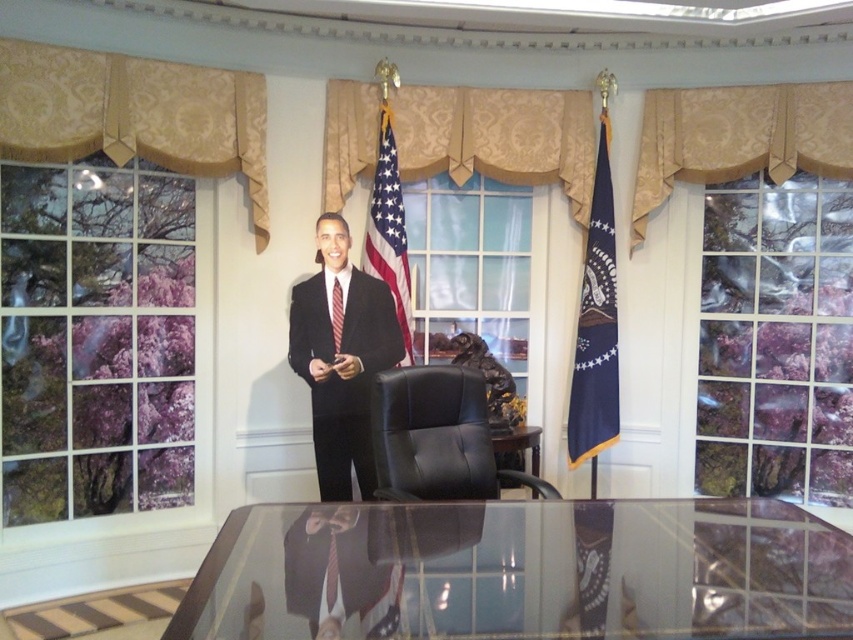
Which is behind, point (320, 344) or point (334, 317)?

Positioned behind is point (334, 317).

I want to click on matte black suit at center, so (341, 358).

Can you confirm if navy blue fabric flag at right is smaller than red silk tie at center?

No.

Is navy blue fabric flag at right above red silk tie at center?

Yes, navy blue fabric flag at right is above red silk tie at center.

Identify the location of navy blue fabric flag at right. (x=596, y=324).

This screenshot has height=640, width=853. I want to click on navy blue fabric flag at right, so click(x=596, y=324).

Does transparent glass table at center appear on the right side of matte black suit at center?

Correct, you'll find transparent glass table at center to the right of matte black suit at center.

Can you confirm if transparent glass table at center is taller than matte black suit at center?

No.

Measure the distance between point [485,618] and camera.

Point [485,618] and camera are 1.54 meters apart from each other.

Locate an element on the screen. This screenshot has height=640, width=853. transparent glass table at center is located at coordinates (521, 572).